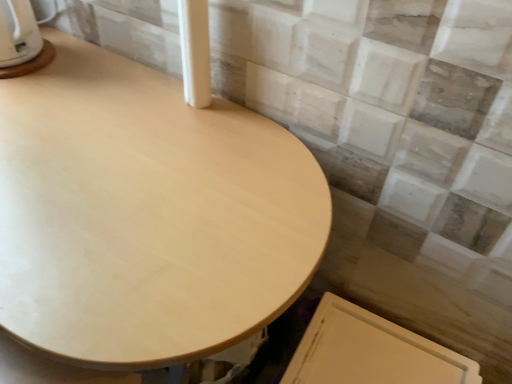
Measure the distance between white smooth pillar at upper center and camera.

white smooth pillar at upper center and camera are 27.09 inches apart.

Describe the element at coordinates (21, 41) in the screenshot. I see `white glossy kettle at upper left` at that location.

Find the location of `white smooth pillar at upper center`. white smooth pillar at upper center is located at coordinates (195, 51).

Which of these two, white smooth pillar at upper center or white glossy kettle at upper left, stands taller?

white smooth pillar at upper center is taller.

You are a GUI agent. You are given a task and a screenshot of the screen. Output one action in this format:
    pyautogui.click(x=<x>, y=<y>)
    Task: Click on the appliance that is behind the white smooth pillar at upper center
    The width and height of the screenshot is (512, 384).
    Given the screenshot: What is the action you would take?
    pyautogui.click(x=21, y=41)

Does white smooth pillar at upper center come behind white glossy kettle at upper left?

That is False.

Is light wood table at center turned away from white glossy kettle at upper left?

light wood table at center is not turned away from white glossy kettle at upper left.

Does point (17, 92) lie in front of point (11, 61)?

Yes, it is in front of point (11, 61).

Is light wood table at center not inside white glossy kettle at upper left?

That's correct, light wood table at center is outside of white glossy kettle at upper left.

From a real-world perspective, between light wood table at center and white glossy kettle at upper left, who is vertically higher?

In real-world perspective, white glossy kettle at upper left is above.

Based on the photo, is white glossy kettle at upper left facing towards light wood table at center?

No, white glossy kettle at upper left is not aimed at light wood table at center.

From a real-world perspective, which is physically above, white glossy kettle at upper left or light wood table at center?

In real-world perspective, white glossy kettle at upper left is above.

In terms of width, does white glossy kettle at upper left look wider or thinner when compared to light wood table at center?

Clearly, white glossy kettle at upper left has less width compared to light wood table at center.

Considering the relative sizes of white glossy kettle at upper left and light wood table at center in the image provided, is white glossy kettle at upper left bigger than light wood table at center?

No.

Can you confirm if white glossy kettle at upper left is thinner than white smooth pillar at upper center?

No.

Based on their positions, is white glossy kettle at upper left located to the left or right of white smooth pillar at upper center?

From the image, it's evident that white glossy kettle at upper left is to the left of white smooth pillar at upper center.

In the scene shown: Is white glossy kettle at upper left oriented towards white smooth pillar at upper center?

No, white glossy kettle at upper left is not facing towards white smooth pillar at upper center.

Image resolution: width=512 pixels, height=384 pixels. What are the coordinates of `appliance that appears behind the white smooth pillar at upper center` in the screenshot? It's located at (21, 41).

Is white smooth pillar at upper center situated inside light wood table at center or outside?

white smooth pillar at upper center is spatially situated outside light wood table at center.

Is point (191, 74) in front of point (65, 247)?

No.

What's the angular difference between white smooth pillar at upper center and light wood table at center's facing directions?

The facing directions of white smooth pillar at upper center and light wood table at center are 5.25 degrees apart.

From the image's perspective, which is above, white smooth pillar at upper center or light wood table at center?

white smooth pillar at upper center is shown above in the image.

From the image's perspective, is light wood table at center beneath white smooth pillar at upper center?

Yes.

Does light wood table at center have a larger size compared to white smooth pillar at upper center?

Yes, light wood table at center is bigger than white smooth pillar at upper center.

Is point (253, 282) in front of point (200, 80)?

Yes.

Is light wood table at center facing away from white smooth pillar at upper center?

light wood table at center is not turned away from white smooth pillar at upper center.

Find the location of `pillar that is on the right side of white glossy kettle at upper left`. pillar that is on the right side of white glossy kettle at upper left is located at coordinates (195, 51).

What are the coordinates of `table below the white glossy kettle at upper left (from the image's perspective)` in the screenshot? It's located at (146, 215).

When comparing their distances from white glossy kettle at upper left, does light wood table at center or white smooth pillar at upper center seem closer?

Based on the image, white smooth pillar at upper center appears to be nearer to white glossy kettle at upper left.

Which object lies nearer to the anchor point light wood table at center, white smooth pillar at upper center or white glossy kettle at upper left?

Based on the image, white smooth pillar at upper center appears to be nearer to light wood table at center.

Based on their spatial positions, is white smooth pillar at upper center or light wood table at center closer to white glossy kettle at upper left?

white smooth pillar at upper center lies closer to white glossy kettle at upper left than the other object.

When comparing their distances from light wood table at center, does white glossy kettle at upper left or white smooth pillar at upper center seem closer?

The object closer to light wood table at center is white smooth pillar at upper center.

From the image, which object appears to be nearer to white smooth pillar at upper center, light wood table at center or white glossy kettle at upper left?

light wood table at center lies closer to white smooth pillar at upper center than the other object.

From the image, which object appears to be farther from white smooth pillar at upper center, white glossy kettle at upper left or light wood table at center?

Among the two, white glossy kettle at upper left is located further to white smooth pillar at upper center.

Locate an element on the screen. The height and width of the screenshot is (384, 512). pillar between white glossy kettle at upper left and light wood table at center in the up-down direction is located at coordinates (195, 51).